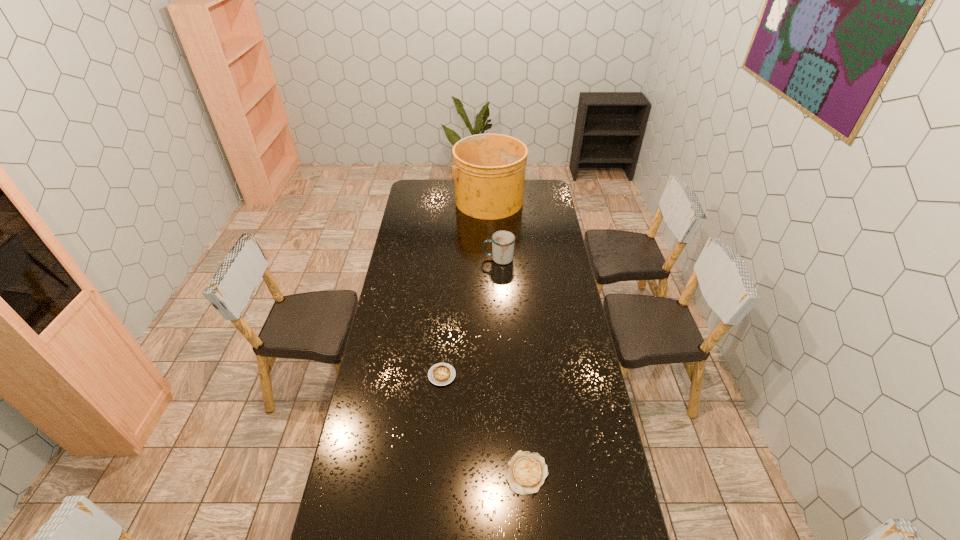
Where is `free spot between the nearer quiche and the third farthest object`? The width and height of the screenshot is (960, 540). free spot between the nearer quiche and the third farthest object is located at coordinates 484,424.

Where is `vacant space that's between the bucket and the nearer quiche`? vacant space that's between the bucket and the nearer quiche is located at coordinates point(507,336).

You are a GUI agent. You are given a task and a screenshot of the screen. Output one action in this format:
    pyautogui.click(x=<x>, y=<y>)
    Task: Click on the free space between the left quiche and the third shortest object
    This screenshot has width=960, height=540.
    Given the screenshot: What is the action you would take?
    pyautogui.click(x=470, y=317)

In order to click on vacant area that lies between the farther quiche and the nearer quiche in this screenshot , I will do `click(484, 424)`.

Where is `free space between the mug and the nearest object`? free space between the mug and the nearest object is located at coordinates (513, 366).

This screenshot has height=540, width=960. What are the coordinates of `empty space between the mug and the right quiche` in the screenshot? It's located at (513, 366).

Locate an element on the screen. The width and height of the screenshot is (960, 540). unoccupied position between the second farthest object and the farther quiche is located at coordinates (470, 317).

At what (x,y) coordinates should I click in order to perform the action: click on vacant space that's between the nearer quiche and the third shortest object. Please return your answer as a coordinate pair (x, y). Looking at the image, I should click on (513, 366).

This screenshot has width=960, height=540. What are the coordinates of `free point between the nearest object and the left quiche` in the screenshot? It's located at (484, 424).

At what (x,y) coordinates should I click in order to perform the action: click on object that ranks as the third closest to the bucket. Please return your answer as a coordinate pair (x, y). This screenshot has height=540, width=960. Looking at the image, I should click on (526, 473).